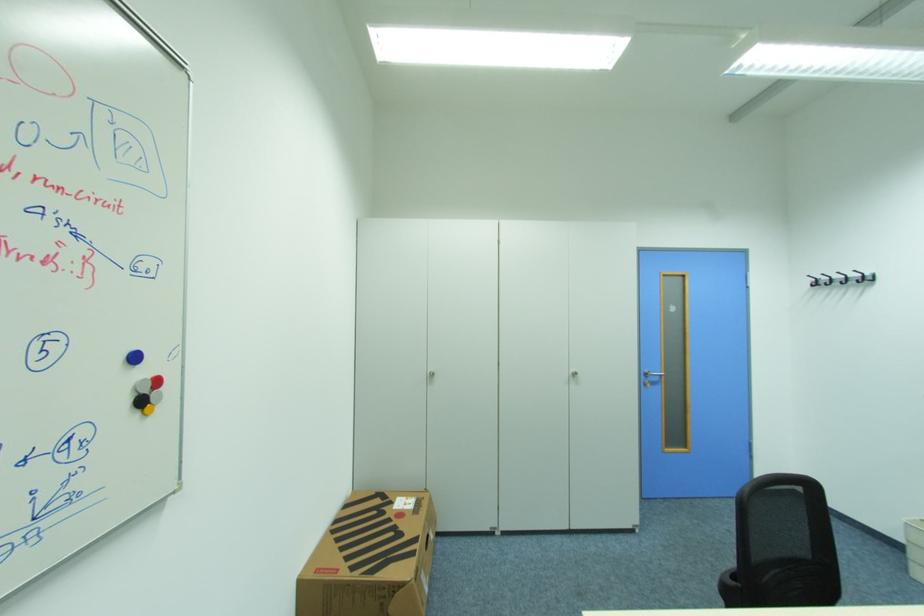
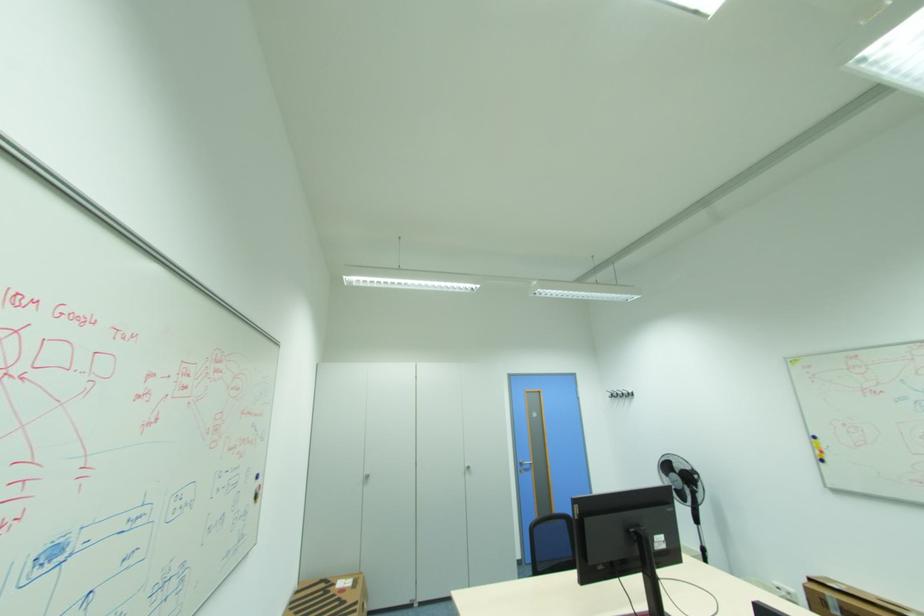
Question: In a continuous first-person perspective shot, in which direction is the camera moving?

Choices:
 (A) Left
 (B) Right
 (C) Forward
 (D) Backward

Answer: (D)